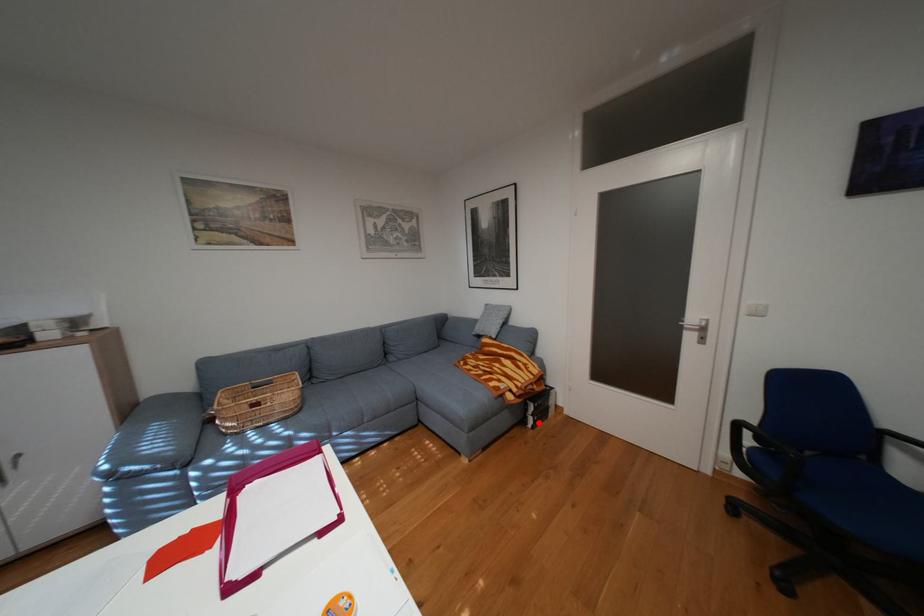
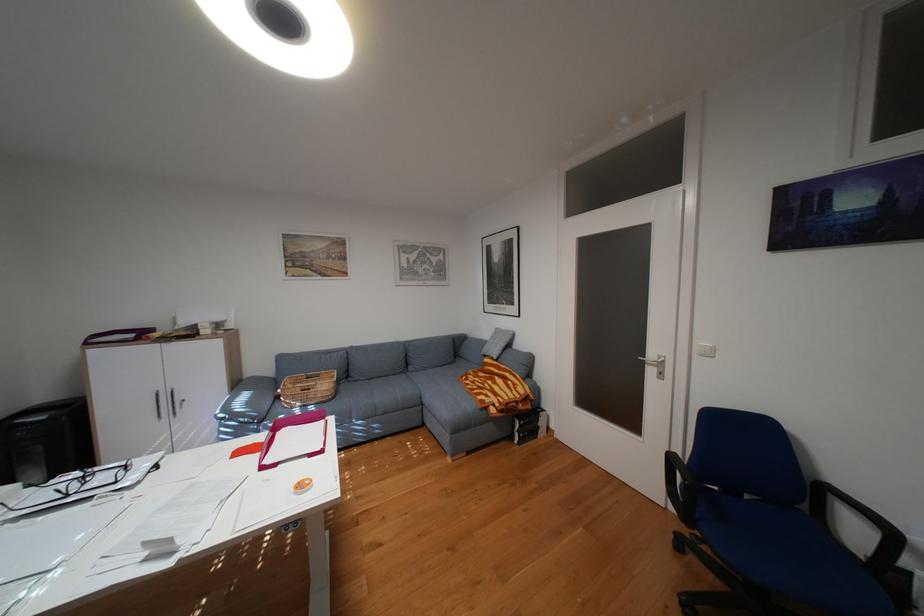
Where in the second image is the point corresponding to the highlighted location from the first image?

(526, 438)